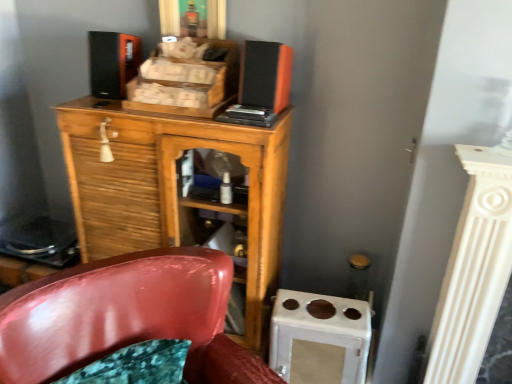
Question: From the image's perspective, does glossy plastic chair at lower left appear higher than matte black speaker at upper center, which is the 1th speaker in right-to-left order?

Choices:
 (A) yes
 (B) no

Answer: (B)

Question: Does glossy plastic chair at lower left have a lesser width compared to matte black speaker at upper center, positioned as the second speaker in left-to-right order?

Choices:
 (A) yes
 (B) no

Answer: (B)

Question: Does glossy plastic chair at lower left come in front of matte black speaker at upper center, which is the 1th speaker in right-to-left order?

Choices:
 (A) yes
 (B) no

Answer: (A)

Question: Is glossy plastic chair at lower left outside of matte black speaker at upper center, which is the 1th speaker in right-to-left order?

Choices:
 (A) yes
 (B) no

Answer: (A)

Question: Would you say glossy plastic chair at lower left contains matte black speaker at upper center, positioned as the second speaker in left-to-right order?

Choices:
 (A) no
 (B) yes

Answer: (A)

Question: From the image's perspective, is glossy plastic chair at lower left below matte black speaker at upper center, positioned as the second speaker in left-to-right order?

Choices:
 (A) yes
 (B) no

Answer: (A)

Question: From a real-world perspective, is matte black speaker at upper center, which is the 1th speaker in right-to-left order, under matte black speaker at upper left, the 1th speaker in the left-to-right sequence?

Choices:
 (A) yes
 (B) no

Answer: (A)

Question: Is matte black speaker at upper center, positioned as the second speaker in left-to-right order, facing away from matte black speaker at upper left, the 1th speaker in the left-to-right sequence?

Choices:
 (A) yes
 (B) no

Answer: (B)

Question: Does matte black speaker at upper center, which is the 1th speaker in right-to-left order, have a greater height compared to matte black speaker at upper left, the second speaker positioned from the right?

Choices:
 (A) no
 (B) yes

Answer: (A)

Question: From a real-world perspective, is matte black speaker at upper center, which is the 1th speaker in right-to-left order, over matte black speaker at upper left, the 1th speaker in the left-to-right sequence?

Choices:
 (A) no
 (B) yes

Answer: (A)

Question: Does matte black speaker at upper center, which is the 1th speaker in right-to-left order, appear on the left side of matte black speaker at upper left, the second speaker positioned from the right?

Choices:
 (A) yes
 (B) no

Answer: (B)

Question: Is the depth of matte black speaker at upper center, positioned as the second speaker in left-to-right order, less than that of matte black speaker at upper left, the 1th speaker in the left-to-right sequence?

Choices:
 (A) no
 (B) yes

Answer: (B)

Question: Is glossy plastic chair at lower left oriented away from wooden cabinet at center?

Choices:
 (A) no
 (B) yes

Answer: (B)